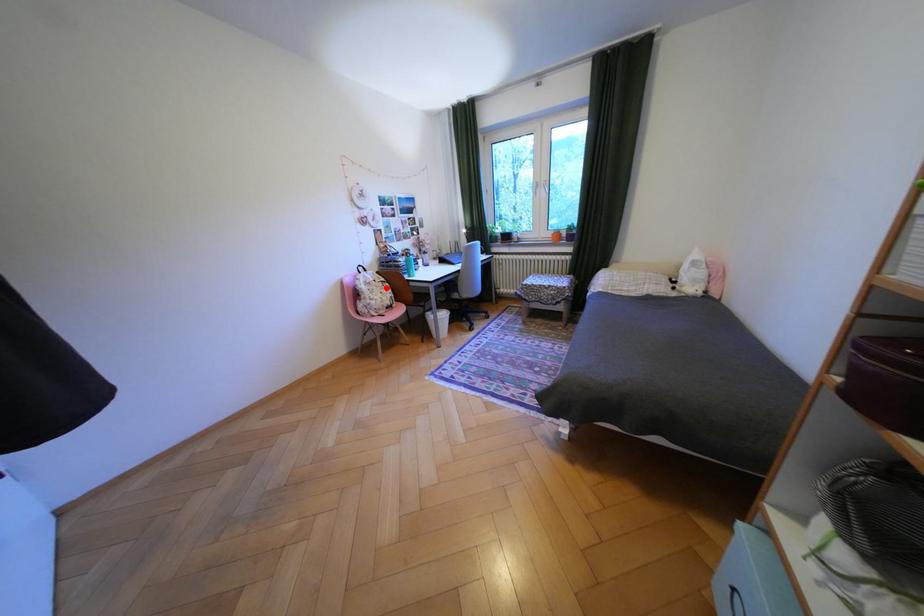
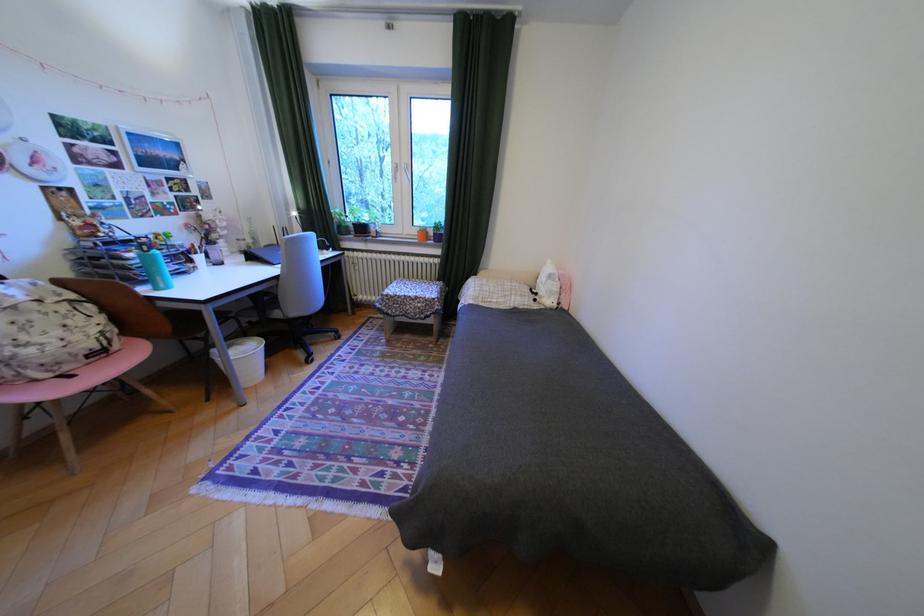
Question: I am providing you with two images of the same scene from different viewpoints. Given a red point in image1, look at the same physical point in image2. Is it:

Choices:
 (A) Closer to the viewpoint
 (B) Farther from the viewpoint

Answer: (B)